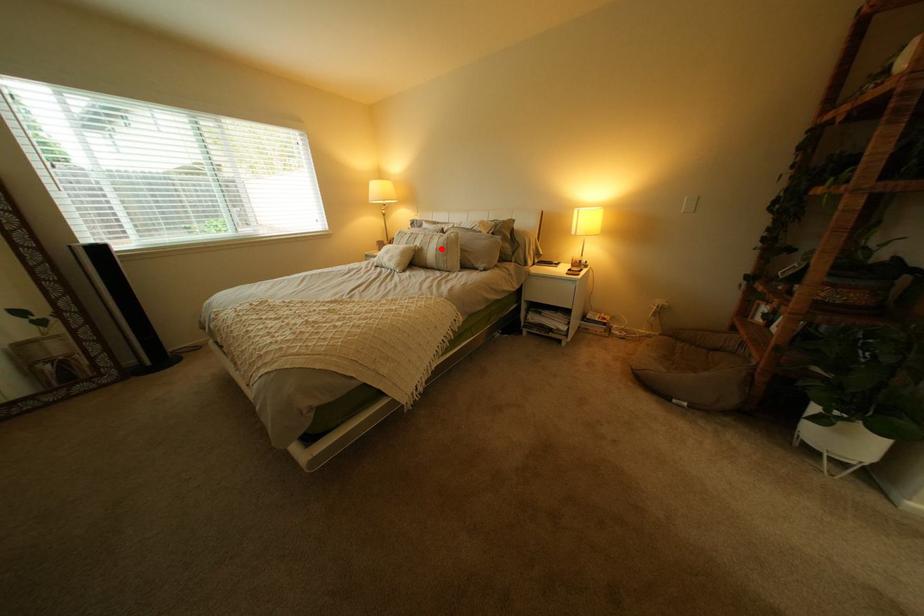
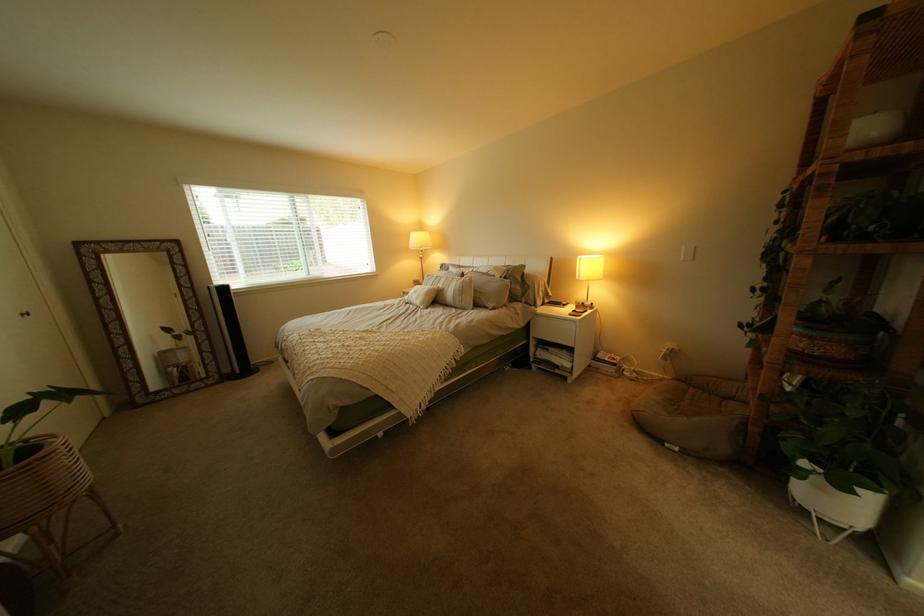
In the second image, find the point that corresponds to the highlighted location in the first image.

(462, 290)